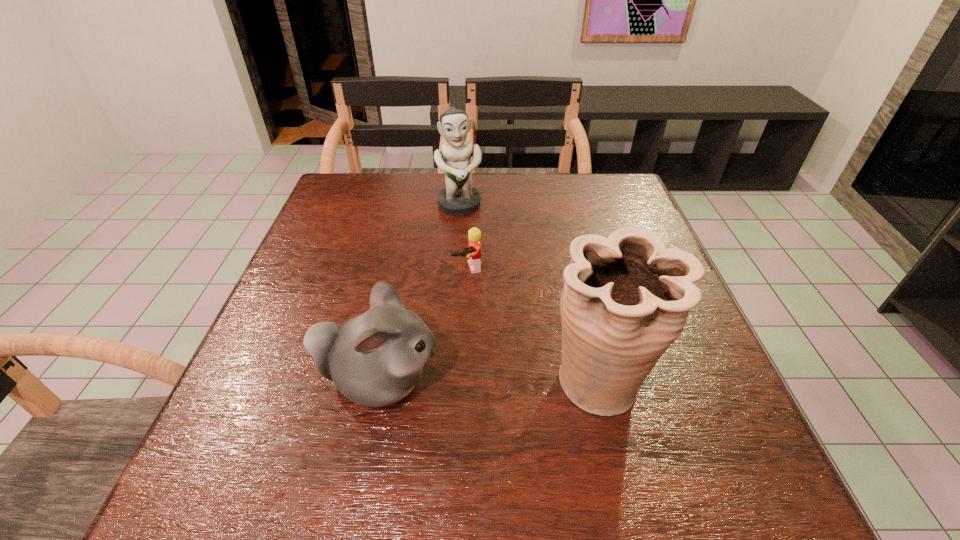
Identify the location of vacant space in between the Lego and the rightmost object. Image resolution: width=960 pixels, height=540 pixels. (534, 325).

Image resolution: width=960 pixels, height=540 pixels. I want to click on empty space between the hamster and the farthest object, so click(x=420, y=294).

The image size is (960, 540). I want to click on empty space that is in between the farthest object and the Lego, so click(x=463, y=238).

Locate which object is the third closest to the rightmost object. Please provide its 2D coordinates. Your answer should be formatted as a tuple, i.e. [(x, y)], where the tuple contains the x and y coordinates of a point satisfying the conditions above.

[(459, 198)]

Where is `object that is the third closest one to the urn`? The image size is (960, 540). object that is the third closest one to the urn is located at coordinates (459, 198).

Locate an element on the screen. The height and width of the screenshot is (540, 960). vacant region that satisfies the following two spatial constraints: 1. on the front side of the Lego; 2. on the left side of the rightmost object is located at coordinates (463, 380).

You are a GUI agent. You are given a task and a screenshot of the screen. Output one action in this format:
    pyautogui.click(x=<x>, y=<y>)
    Task: Click on the vacant region that satisfies the following two spatial constraints: 1. on the front side of the rightmost object; 2. on the right side of the Lego
    The height and width of the screenshot is (540, 960).
    Given the screenshot: What is the action you would take?
    pyautogui.click(x=463, y=380)

Locate an element on the screen. The image size is (960, 540). vacant area that satisfies the following two spatial constraints: 1. on the front side of the farthest object; 2. on the right side of the shortest object is located at coordinates (455, 269).